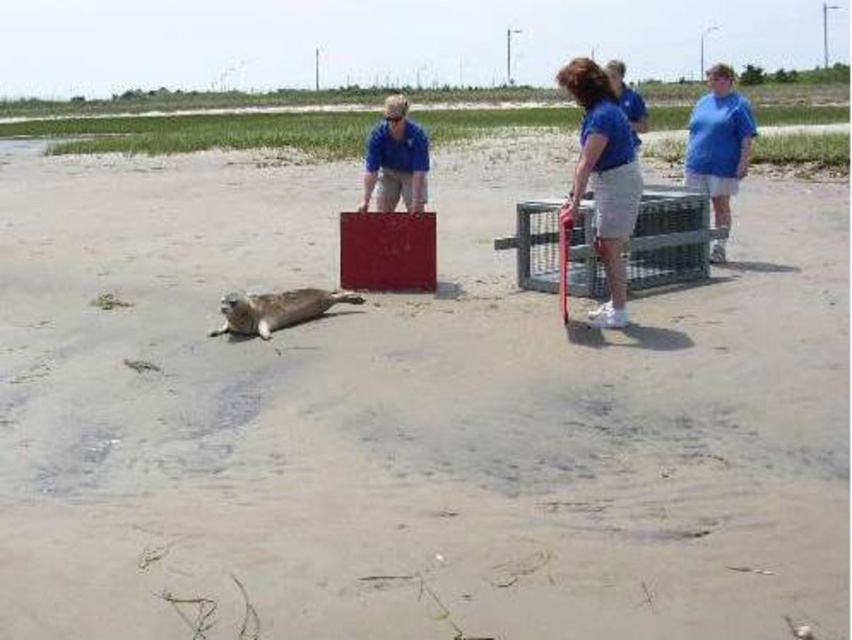
You are a wildlife photographer who needs to take a photo of the blue cotton shirt at center from a distance that won

The blue cotton shirt at center and camera are 7.59 meters apart, so you can take the photo from that distance.

You are a wildlife photographer observing the seal rescue on the beach. You need to capture a clear photo of both the blue cotton shirt at center and the blue cotton shirt at right. Which shirt should you focus on first to ensure both are in the frame?

You should focus on the blue cotton shirt at center first because it is closer to you than the blue cotton shirt at right, ensuring both are in the frame.

You are a wildlife rescuer standing at point A, which is at coordinates point (697,124), and you need to reach point B, which is at coordinates point (308,294). Which point is closer to you?

Point A at coordinates point (697,124) is closer to you because it is further to the viewer than point B at coordinates point (308,294).